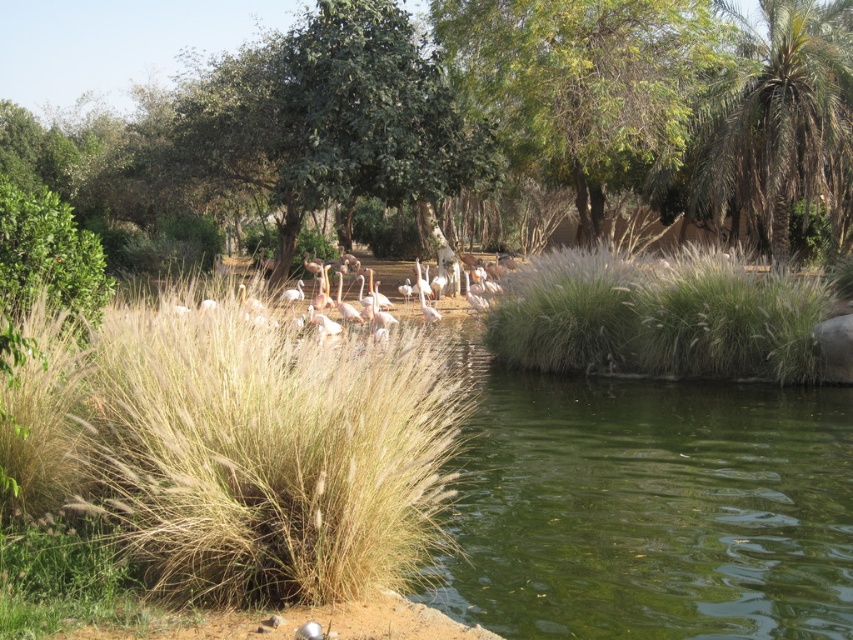
Measure the distance between point (497, 99) and camera.

Point (497, 99) is 24.19 meters from camera.

This screenshot has width=853, height=640. Identify the location of green leafy tree at upper center. (583, 83).

Which is in front, point (527, 168) or point (436, 314)?

Positioned in front is point (436, 314).

The image size is (853, 640). In order to click on green leafy tree at upper center in this screenshot , I will do `click(583, 83)`.

Is the position of green leafy palm tree at right more distant than that of pink feathered birds at center?

That is True.

Describe the element at coordinates (781, 129) in the screenshot. This screenshot has width=853, height=640. I see `green leafy palm tree at right` at that location.

The height and width of the screenshot is (640, 853). What are the coordinates of `green leafy palm tree at right` in the screenshot? It's located at (781, 129).

Where is `green leafy palm tree at right`? The image size is (853, 640). green leafy palm tree at right is located at coordinates (781, 129).

Does golden textured grass at center have a lesser width compared to green leafy tree at center?

Yes.

Can you confirm if golden textured grass at center is smaller than green leafy tree at center?

Yes.

This screenshot has width=853, height=640. Describe the element at coordinates (241, 445) in the screenshot. I see `golden textured grass at center` at that location.

You are a GUI agent. You are given a task and a screenshot of the screen. Output one action in this format:
    pyautogui.click(x=<x>, y=<y>)
    Task: Click on the golden textured grass at center
    
    Given the screenshot: What is the action you would take?
    pyautogui.click(x=241, y=445)